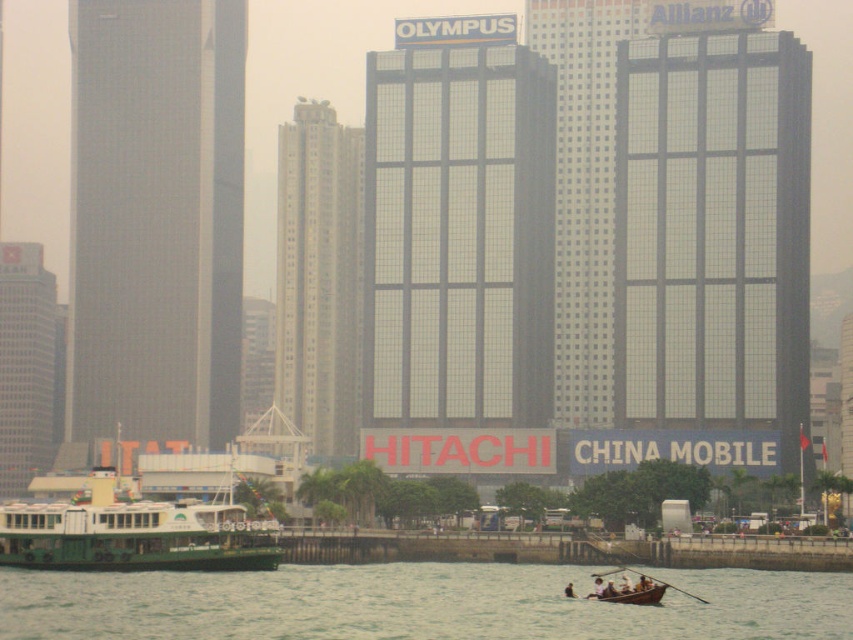
You are standing on the dock and see the wooden canoe at lower center and the wooden at lower right. Which one is closer to the water surface?

The wooden at lower right is closer to the water surface because the wooden canoe at lower center is located above it.

Consider the image. You are a tourist standing on the waterfront and want to take a photo of both the green matte ferryboat at lower left and the wooden at lower right. Since you can only focus on one object at a time, which one should you aim your camera at to ensure the other is still in the frame?

The green matte ferryboat at lower left is above the wooden at lower right, so you should aim your camera at the green matte ferryboat at lower left to ensure the wooden at lower right is still in the frame below it.

Consider the image. You are standing at the point with coordinates point (614, 593) and want to walk towards the point with coordinates point (627, 570). Which direction should you face to move towards your destination?

You should face backwards because point (614, 593) is in front of point (627, 570), meaning the destination is behind you.